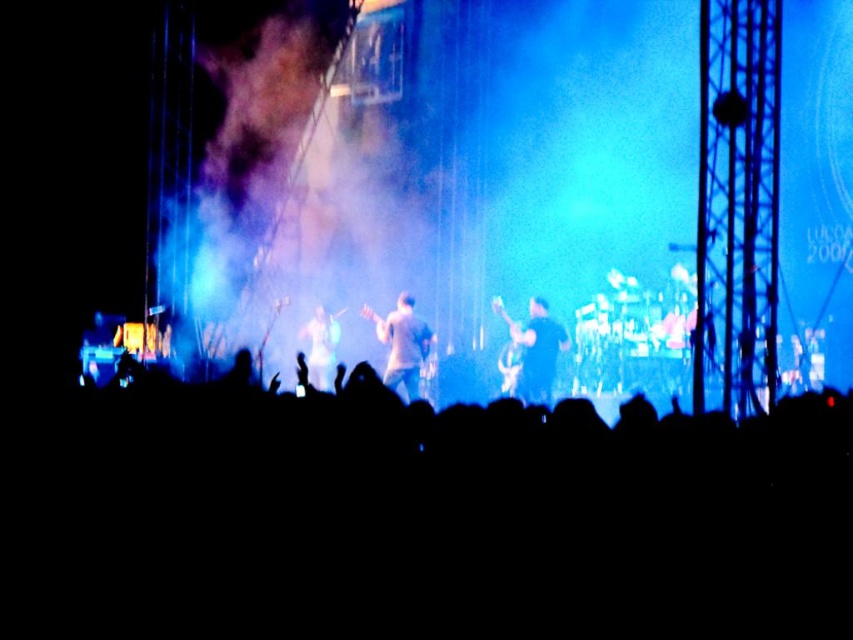
Is smoke at center to the right of shiny silver guitar at center from the viewer's perspective?

Correct, you'll find smoke at center to the right of shiny silver guitar at center.

Which is more to the left, smoke at center or shiny silver guitar at center?

From the viewer's perspective, shiny silver guitar at center appears more on the left side.

Does point (328, 259) come farther from viewer compared to point (334, 348)?

Yes, point (328, 259) is behind point (334, 348).

Where is `smoke at center`? The width and height of the screenshot is (853, 640). smoke at center is located at coordinates (357, 205).

Is black silhouettes at lower center below shiny silver guitar at center?

Correct, black silhouettes at lower center is located below shiny silver guitar at center.

Describe the element at coordinates (419, 518) in the screenshot. The image size is (853, 640). I see `black silhouettes at lower center` at that location.

This screenshot has height=640, width=853. What do you see at coordinates (419, 518) in the screenshot? I see `black silhouettes at lower center` at bounding box center [419, 518].

Locate an element on the screen. black silhouettes at lower center is located at coordinates (419, 518).

Between light brown fabric shirt at center and shiny silver guitar at center, which one is positioned higher?

shiny silver guitar at center is above.

Does light brown fabric shirt at center lie behind shiny silver guitar at center?

No, it is not.

Who is more distant from viewer, [409,308] or [332,333]?

The point [332,333] is more distant.

Find the location of a particular element. light brown fabric shirt at center is located at coordinates (402, 344).